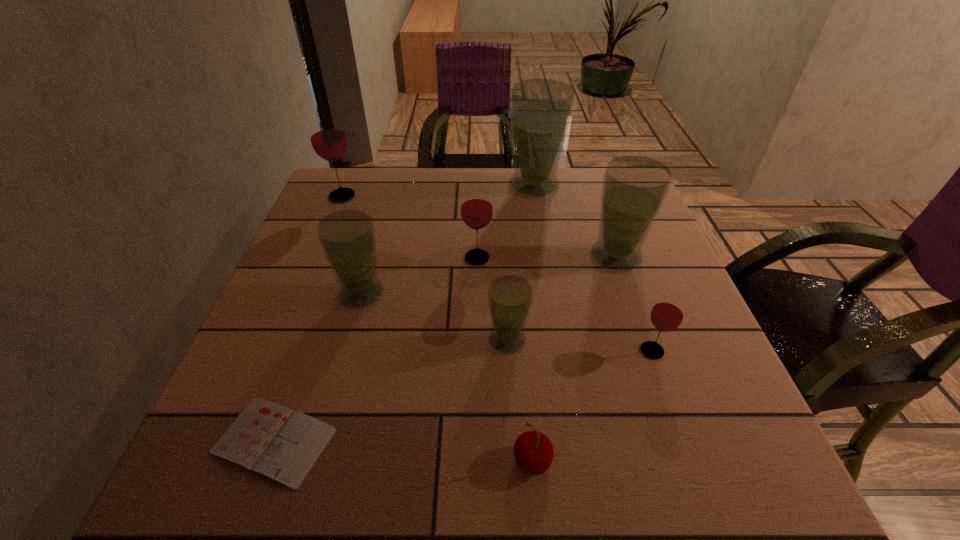
Find the location of a particular element. the tallest object is located at coordinates tap(541, 109).

At what (x,y) coordinates should I click in order to perform the action: click on the tallest glass. Please return your answer as a coordinate pair (x, y). The width and height of the screenshot is (960, 540). Looking at the image, I should click on (541, 109).

Find the location of a particular element. This screenshot has height=540, width=960. the leftmost glass is located at coordinates (327, 135).

Where is `the leftmost red glass`? The image size is (960, 540). the leftmost red glass is located at coordinates (327, 135).

Locate an element on the screen. The height and width of the screenshot is (540, 960). the third nearest blue glass is located at coordinates (634, 188).

You are a GUI agent. You are given a task and a screenshot of the screen. Output one action in this format:
    pyautogui.click(x=<x>, y=<y>)
    Task: Click on the third smallest blue glass
    
    Given the screenshot: What is the action you would take?
    pyautogui.click(x=634, y=188)

The height and width of the screenshot is (540, 960). What are the coordinates of `the second smallest red glass` in the screenshot? It's located at (476, 209).

At what (x,y) coordinates should I click in order to perform the action: click on the second nearest red glass. Please return your answer as a coordinate pair (x, y). The height and width of the screenshot is (540, 960). Looking at the image, I should click on (476, 209).

At what (x,y) coordinates should I click in order to perform the action: click on the third nearest glass. Please return your answer as a coordinate pair (x, y). The width and height of the screenshot is (960, 540). Looking at the image, I should click on (348, 240).

Image resolution: width=960 pixels, height=540 pixels. In order to click on the second smallest blue glass in this screenshot , I will do `click(348, 240)`.